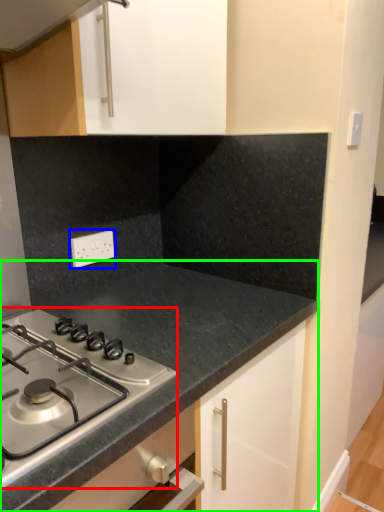
Question: Which is nearer to the gas stove (highlighted by a red box)? electric outlet (highlighted by a blue box) or countertop (highlighted by a green box).

Choices:
 (A) electric outlet
 (B) countertop

Answer: (B)